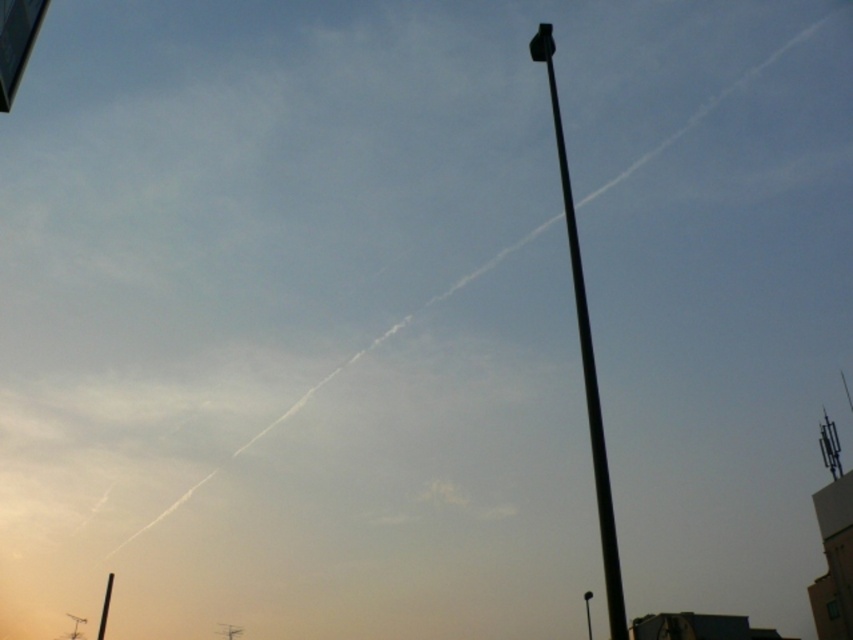
Is black metal pole at upper right closer to camera compared to black metal pole at lower left?

Yes, black metal pole at upper right is in front of black metal pole at lower left.

In the scene shown: Can you confirm if black metal pole at upper right is positioned to the right of black metal pole at lower left?

Correct, you'll find black metal pole at upper right to the right of black metal pole at lower left.

Between point (575, 228) and point (109, 586), which one is positioned in front?

Point (575, 228) is in front.

Where is `black metal pole at upper right`? This screenshot has width=853, height=640. black metal pole at upper right is located at coordinates (585, 356).

Does black metal pole at upper right come in front of metallic rectangular sign at upper left?

Yes, it is.

Locate an element on the screen. The image size is (853, 640). black metal pole at upper right is located at coordinates (585, 356).

Locate an element on the screen. black metal pole at upper right is located at coordinates (585, 356).

Which is more to the left, metallic rectangular sign at upper left or black metal pole at lower left?

black metal pole at lower left

Between metallic rectangular sign at upper left and black metal pole at lower left, which one has less height?

With less height is black metal pole at lower left.

Locate an element on the screen. Image resolution: width=853 pixels, height=640 pixels. metallic rectangular sign at upper left is located at coordinates (16, 42).